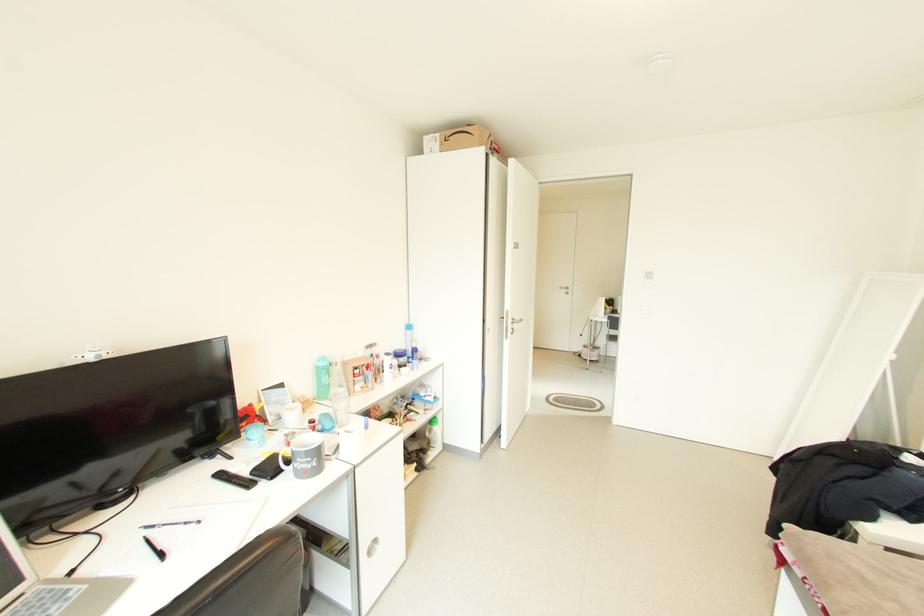
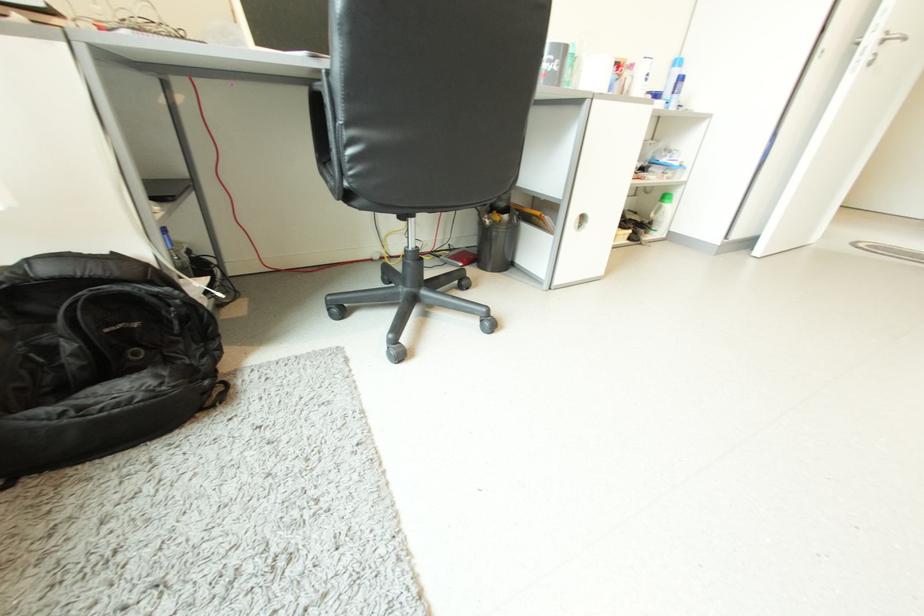
Locate, in the second image, the point that corresponds to point 415,328 in the first image.

(681, 63)